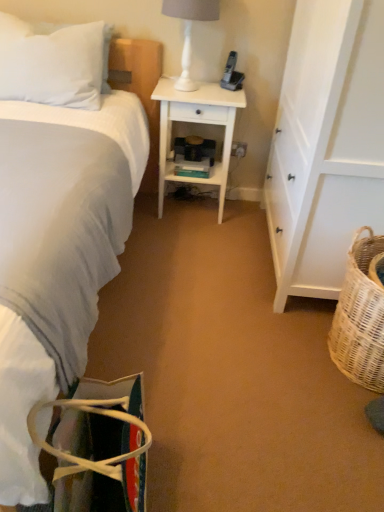
Locate an element on the screen. vacant region to the right of white wood desk at center is located at coordinates (247, 220).